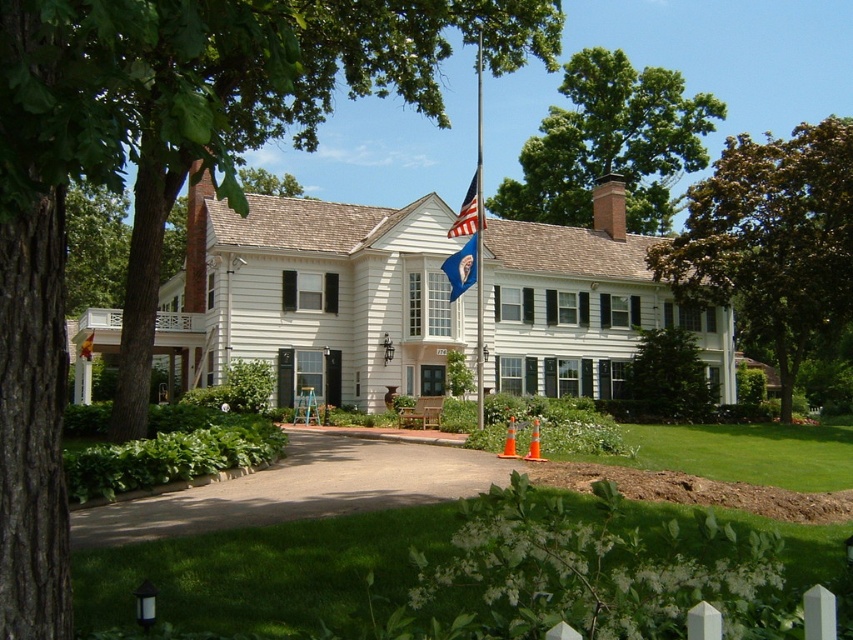
You are driving a delivery van that is 2.5 meters wide. You need to park on the smooth asphalt driveway at center. Is there enough space for your van if there is a green leafy tree at center blocking part of the driveway?

The smooth asphalt driveway at center might be wider than green leafy tree at center, so there could be enough space for the van, but the tree might block part of it. Check the actual width before parking.